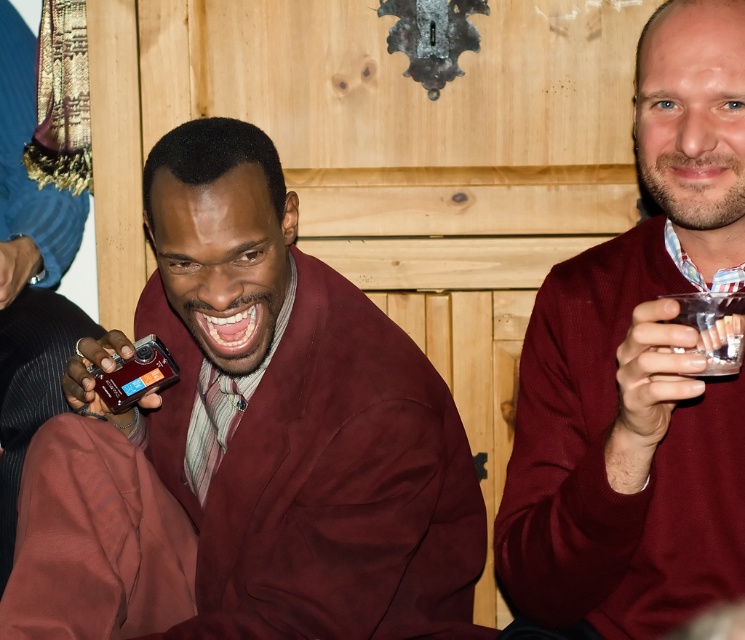
You are a fashion designer observing the two sweaters in the image. The matte burgundy sweater at left and the maroon sweater at center. Which one is positioned lower in the image?

The matte burgundy sweater at left is located below the maroon sweater at center, so it is positioned lower in the image.

Based on the photo, what is located at the coordinate point (247, 442) in the image?

The coordinate point (247, 442) is occupied by the matte burgundy sweater at left.

You are standing in the room and want to place a small decoration between the two points, point (206,566) and point (568,564). Which point should the decoration be closer to in order to be in front of both points?

The decoration should be closer to point (568,564) because point (206,566) is behind point (568,564), so placing it closer to the front point would keep it in front of both.